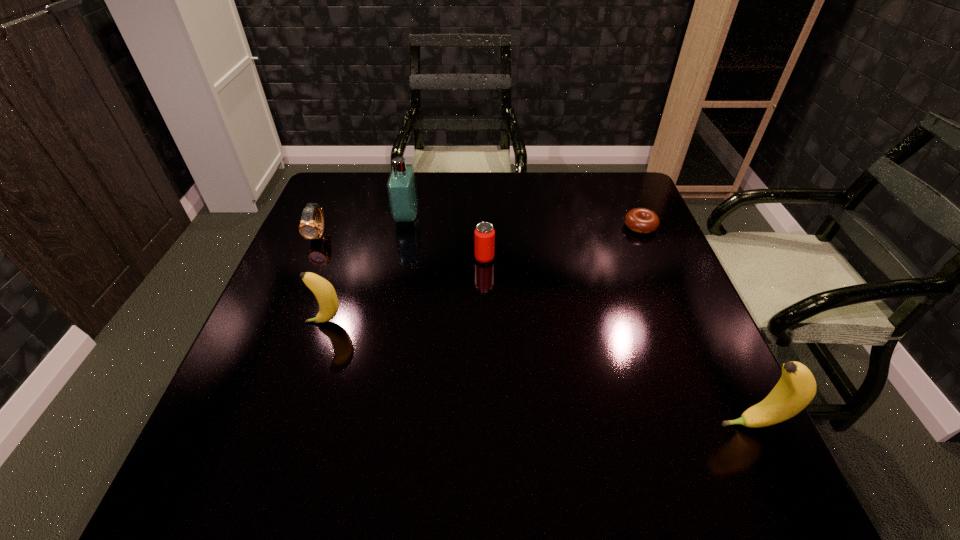
Find the location of `banana that is at the left edge`. banana that is at the left edge is located at coordinates (323, 290).

Image resolution: width=960 pixels, height=540 pixels. Identify the location of watch situated at the left edge. (309, 229).

In order to click on banana situated at the right edge in this screenshot , I will do `click(796, 388)`.

Find the location of `doughnut present at the right edge`. doughnut present at the right edge is located at coordinates (641, 220).

You are a GUI agent. You are given a task and a screenshot of the screen. Output one action in this format:
    pyautogui.click(x=<x>, y=<y>)
    Task: Click on the object that is at the near right corner
    This screenshot has height=540, width=960.
    Given the screenshot: What is the action you would take?
    pyautogui.click(x=796, y=388)

This screenshot has width=960, height=540. Identify the location of free space at the far edge of the desktop. (418, 188).

The height and width of the screenshot is (540, 960). I want to click on free space at the near edge of the desktop, so 396,409.

Find the location of `free space at the left edge of the desktop`. free space at the left edge of the desktop is located at coordinates (313, 382).

This screenshot has width=960, height=540. I want to click on vacant space at the right edge of the desktop, so click(x=674, y=358).

Where is `vacant space at the far left corner of the desktop`? vacant space at the far left corner of the desktop is located at coordinates (351, 178).